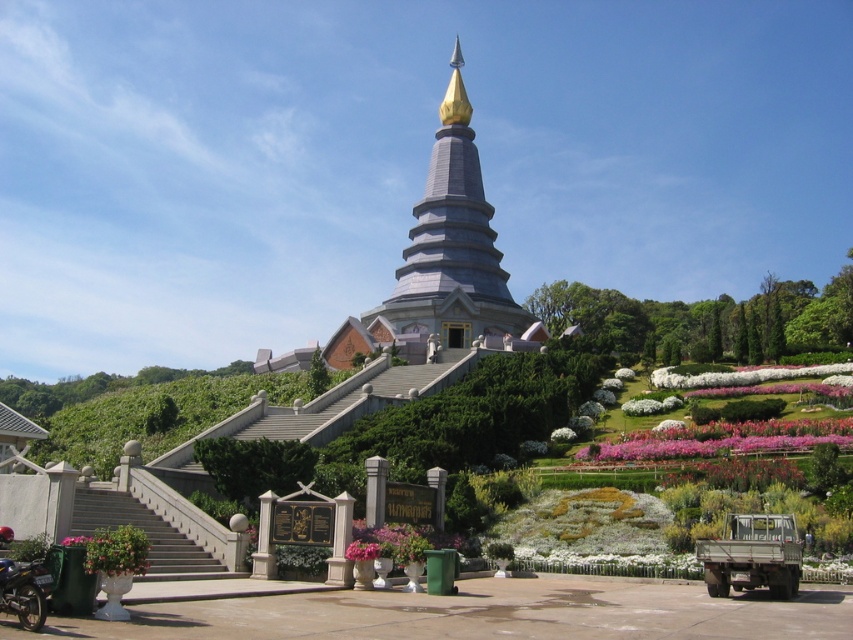
Can you confirm if metallic silver motorcycle at lower left is smaller than pink fabric flower at lower left?

Yes.

Does metallic silver motorcycle at lower left appear on the left side of pink fabric flower at lower left?

No, metallic silver motorcycle at lower left is not to the left of pink fabric flower at lower left.

This screenshot has width=853, height=640. In order to click on metallic silver motorcycle at lower left in this screenshot , I will do `click(24, 589)`.

Does point (212, 576) come behind point (105, 566)?

Yes, it is.

Which is more to the right, gray concrete stairs at lower left or pink fabric flower at lower left?

pink fabric flower at lower left is more to the right.

Between point (76, 525) and point (125, 532), which one is positioned behind?

The point (76, 525) is behind.

The height and width of the screenshot is (640, 853). I want to click on gray concrete stairs at lower left, so click(x=146, y=534).

Image resolution: width=853 pixels, height=640 pixels. Describe the element at coordinates (146, 534) in the screenshot. I see `gray concrete stairs at lower left` at that location.

Does gray concrete stairs at lower left have a greater width compared to metallic silver motorcycle at lower left?

Yes, gray concrete stairs at lower left is wider than metallic silver motorcycle at lower left.

Between point (105, 492) and point (0, 604), which one is positioned behind?

The point (105, 492) is behind.

At what (x,y) coordinates should I click in order to perform the action: click on gray concrete stairs at lower left. Please return your answer as a coordinate pair (x, y). Looking at the image, I should click on (146, 534).